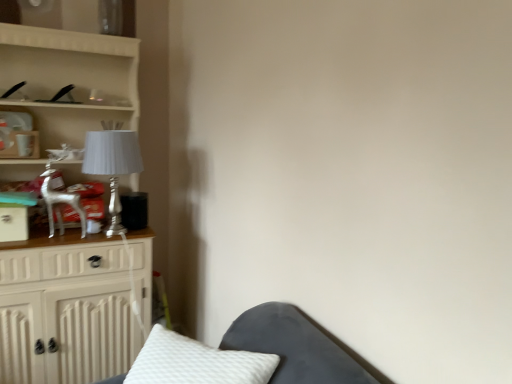
What do you see at coordinates (112, 163) in the screenshot? Image resolution: width=512 pixels, height=384 pixels. I see `silver metallic table lamp at left` at bounding box center [112, 163].

What are the coordinates of `silver metallic table lamp at left` in the screenshot? It's located at (112, 163).

This screenshot has width=512, height=384. What do you see at coordinates (65, 309) in the screenshot?
I see `white glossy cabinet at left` at bounding box center [65, 309].

You are a GUI agent. You are given a task and a screenshot of the screen. Output one action in this format:
    pyautogui.click(x=<x>, y=<y>)
    Task: Click on the white glossy cabinet at left
    The width and height of the screenshot is (512, 384).
    Given the screenshot: What is the action you would take?
    (x=65, y=309)

Where is `silver metallic table lamp at left`? The image size is (512, 384). silver metallic table lamp at left is located at coordinates (112, 163).

Visually, is white glossy cabinet at left positioned to the left or to the right of silver metallic table lamp at left?

white glossy cabinet at left is to the left of silver metallic table lamp at left.

Is white glossy cabinet at left positioned in front of silver metallic table lamp at left?

Yes, it is.

Is point (66, 354) more distant than point (122, 144)?

Yes, point (66, 354) is behind point (122, 144).

From the image's perspective, which one is positioned lower, white glossy cabinet at left or silver metallic table lamp at left?

white glossy cabinet at left is shown below in the image.

From a real-world perspective, is white glossy cabinet at left physically located above or below silver metallic table lamp at left?

white glossy cabinet at left is situated lower than silver metallic table lamp at left in the real world.

Can you confirm if white glossy cabinet at left is wider than silver metallic table lamp at left?

Correct, the width of white glossy cabinet at left exceeds that of silver metallic table lamp at left.

Between white glossy cabinet at left and silver metallic table lamp at left, which one has less height?

silver metallic table lamp at left is shorter.

Who is smaller, white glossy cabinet at left or silver metallic table lamp at left?

Smaller between the two is silver metallic table lamp at left.

Is white glossy cabinet at left inside the boundaries of silver metallic table lamp at left, or outside?

white glossy cabinet at left is not inside silver metallic table lamp at left, it's outside.

Is white glossy cabinet at left positioned far away from silver metallic table lamp at left?

No.

Could you tell me if white glossy cabinet at left is turned towards silver metallic table lamp at left?

Yes, white glossy cabinet at left is oriented towards silver metallic table lamp at left.

Image resolution: width=512 pixels, height=384 pixels. I want to click on table lamp behind the white glossy cabinet at left, so click(x=112, y=163).

Based on the photo, would you say silver metallic table lamp at left is to the left or to the right of white glossy cabinet at left in the picture?

silver metallic table lamp at left is to the right of white glossy cabinet at left.

Is silver metallic table lamp at left closer to camera compared to white glossy cabinet at left?

No, silver metallic table lamp at left is behind white glossy cabinet at left.

Does point (118, 230) come in front of point (149, 295)?

That is True.

From the image's perspective, who appears lower, silver metallic table lamp at left or white glossy cabinet at left?

white glossy cabinet at left appears lower in the image.

From a real-world perspective, is silver metallic table lamp at left above or below white glossy cabinet at left?

Clearly, from a real-world perspective, silver metallic table lamp at left is above white glossy cabinet at left.

Considering the sizes of silver metallic table lamp at left and white glossy cabinet at left in the image, is silver metallic table lamp at left wider or thinner than white glossy cabinet at left?

Considering their sizes, silver metallic table lamp at left looks slimmer than white glossy cabinet at left.

Can you confirm if silver metallic table lamp at left is shorter than white glossy cabinet at left?

Yes.

Between silver metallic table lamp at left and white glossy cabinet at left, which one has smaller size?

With smaller size is silver metallic table lamp at left.

Can white glossy cabinet at left be found inside silver metallic table lamp at left?

No.

Is silver metallic table lamp at left not near white glossy cabinet at left?

No, silver metallic table lamp at left is in close proximity to white glossy cabinet at left.

Is silver metallic table lamp at left positioned with its back to white glossy cabinet at left?

Answer: Yes, silver metallic table lamp at left's orientation is away from white glossy cabinet at left.

Can you tell me how much silver metallic table lamp at left and white glossy cabinet at left differ in facing direction?

They differ by 0.000701 degrees in their facing directions.

How distant is silver metallic table lamp at left from white glossy cabinet at left?

12.61 inches.

The image size is (512, 384). What are the coordinates of `table lamp behind the white glossy cabinet at left` in the screenshot? It's located at (112, 163).

This screenshot has height=384, width=512. I want to click on table lamp located on the right of white glossy cabinet at left, so click(112, 163).

At what (x,y) coordinates should I click in order to perform the action: click on table lamp positioned vertically above the white glossy cabinet at left (from a real-world perspective). Please return your answer as a coordinate pair (x, y). The height and width of the screenshot is (384, 512). Looking at the image, I should click on (112, 163).